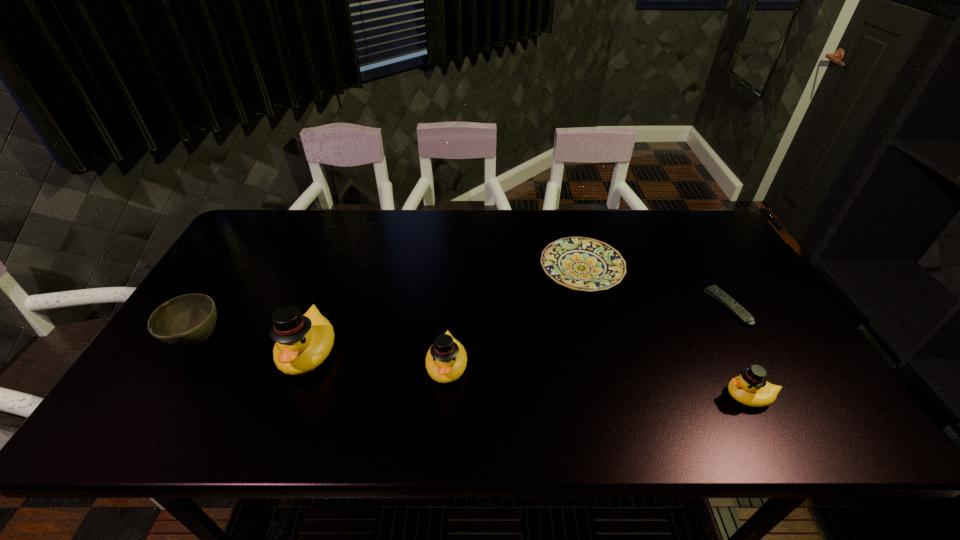
The height and width of the screenshot is (540, 960). I want to click on the second object from left to right, so click(302, 342).

Identify the location of the leftmost duck. (302, 342).

Find the location of a particular element. the second shortest duck is located at coordinates (446, 360).

Where is `the second duck from left to right`? The image size is (960, 540). the second duck from left to right is located at coordinates (446, 360).

Find the location of a particular element. Image resolution: width=960 pixels, height=540 pixels. the shortest duck is located at coordinates (750, 388).

I want to click on the shortest object, so click(718, 294).

This screenshot has width=960, height=540. I want to click on the leftmost object, so click(x=188, y=320).

Locate an element on the screen. the fifth tallest object is located at coordinates (579, 263).

Image resolution: width=960 pixels, height=540 pixels. What are the coordinates of `the third object from right to left` in the screenshot? It's located at (579, 263).

Locate an element on the screen. This screenshot has width=960, height=540. vacant area situated on the front-facing side of the shortest duck is located at coordinates (649, 396).